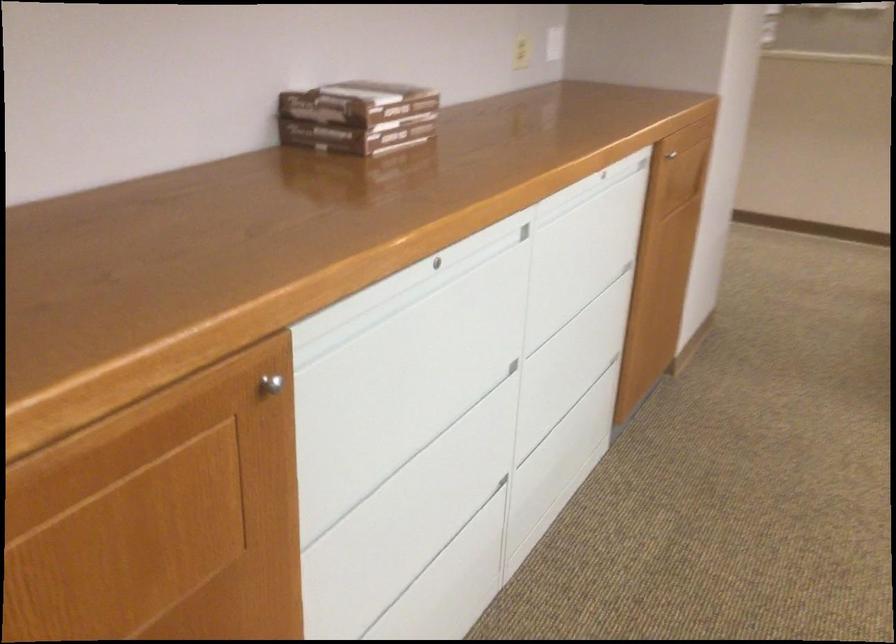
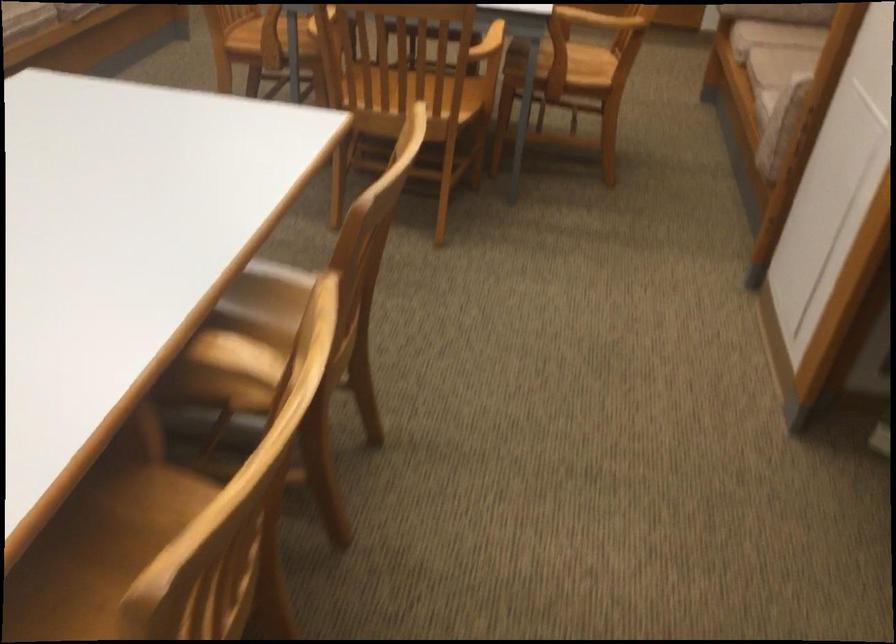
How did the camera likely rotate?

The camera's rotation is toward right-down.